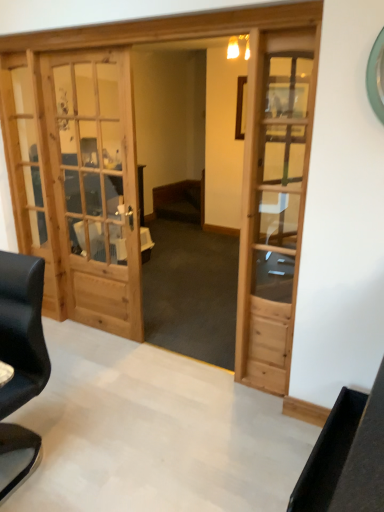
Question: In terms of width, does wooden table at center look wider or thinner when compared to light brown wooden door at center?

Choices:
 (A) wide
 (B) thin

Answer: (A)

Question: From a real-world perspective, is wooden table at center above or below light brown wooden door at center?

Choices:
 (A) below
 (B) above

Answer: (A)

Question: Considering the real-world distances, which object is farthest from the black leather chair at left?

Choices:
 (A) light brown wooden door at center
 (B) wooden table at center

Answer: (B)

Question: Estimate the real-world distances between objects in this image. Which object is farther from the black leather chair at left?

Choices:
 (A) wooden table at center
 (B) light brown wooden door at center

Answer: (A)